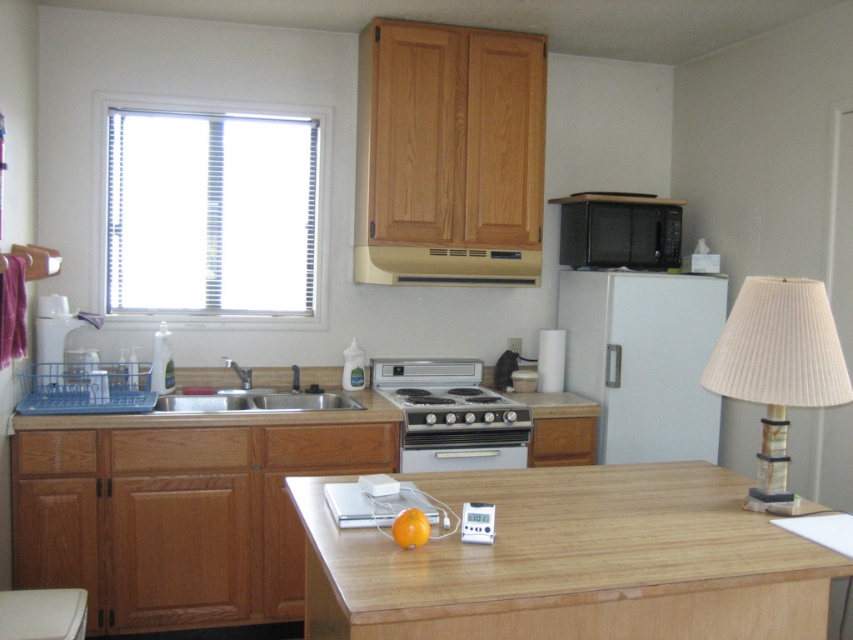
You are standing in the kitchen and want to wash your hands. Where is the silver metallic sink at lower center located?

The silver metallic sink at lower center is located at point (253, 392).

You are standing in the kitchen and notice two points marked in the scene. Which of the two points, point (270, 387) or point (395, 266), is closer to you?

Point (270, 387) is closer to you because it is further to the viewer than point (395, 266).